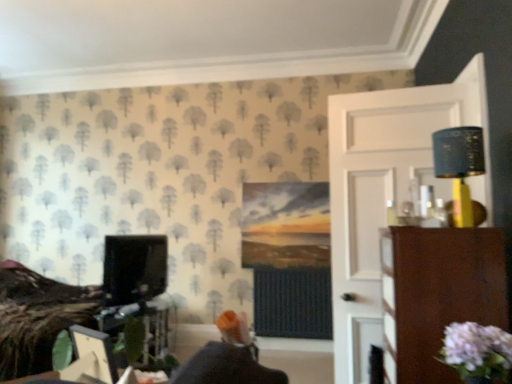
Question: From a real-world perspective, is matte black monitor at left above or below pale pink fabric flower at lower right?

Choices:
 (A) below
 (B) above

Answer: (B)

Question: Does point (133, 274) appear closer or farther from the camera than point (493, 377)?

Choices:
 (A) closer
 (B) farther

Answer: (B)

Question: Based on their relative distances, which object is nearer to the pale pink fabric flower at lower right?

Choices:
 (A) matte black lampshade at upper right
 (B) brown wood dresser at right
 (C) matte black monitor at left

Answer: (B)

Question: Which object is positioned farthest from the matte black monitor at left?

Choices:
 (A) brown wood dresser at right
 (B) matte black lampshade at upper right
 (C) pale pink fabric flower at lower right

Answer: (C)